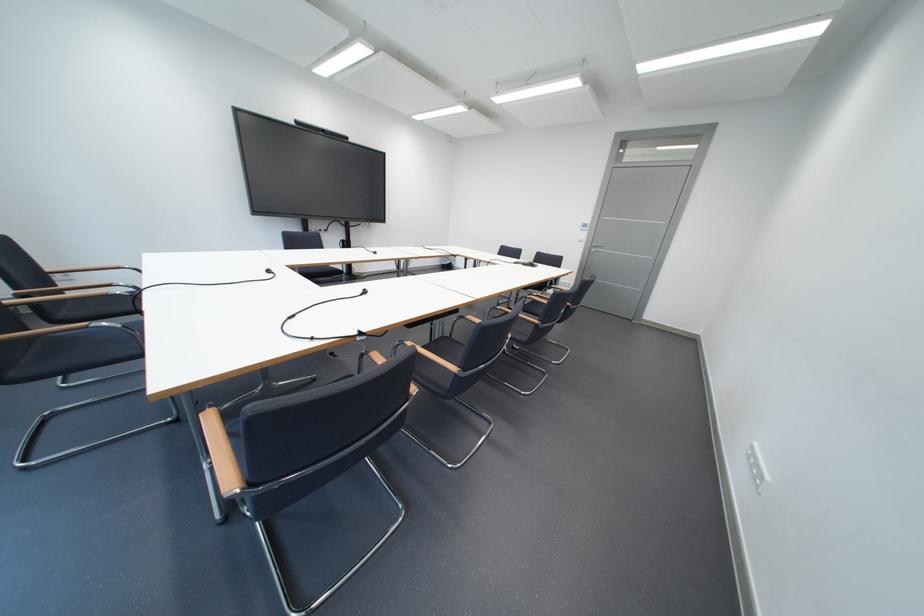
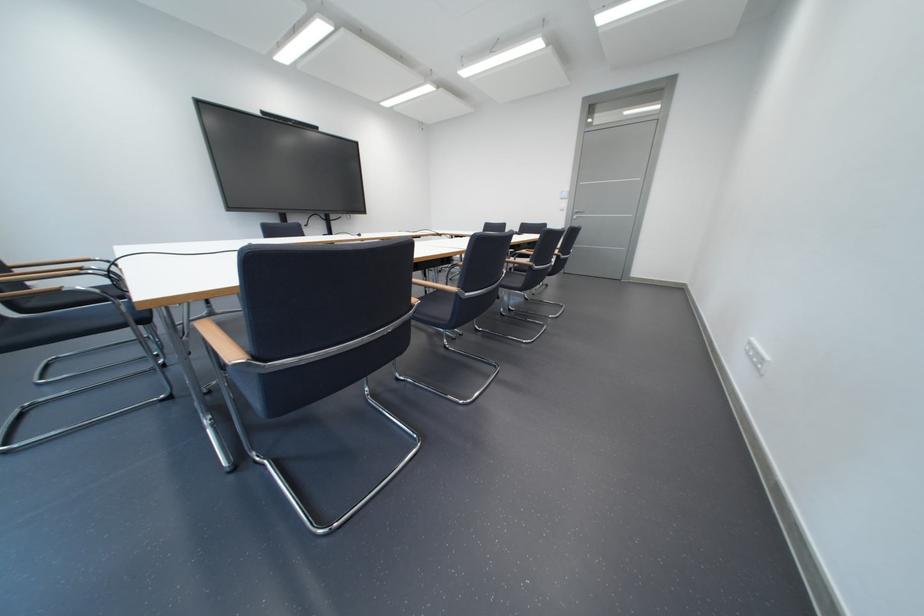
Question: The camera is either moving clockwise (left) or counter-clockwise (right) around the object. The first image is from the beginning of the video and the second image is from the end. Is the camera moving left or right when shooting the video?

Choices:
 (A) Left
 (B) Right

Answer: (A)